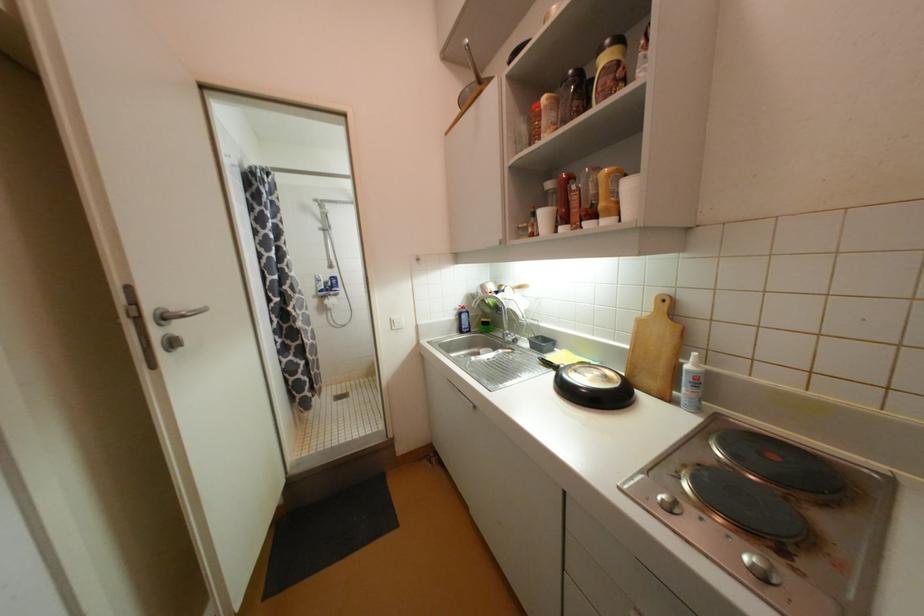
The width and height of the screenshot is (924, 616). Describe the element at coordinates (509, 338) in the screenshot. I see `a faucet handle` at that location.